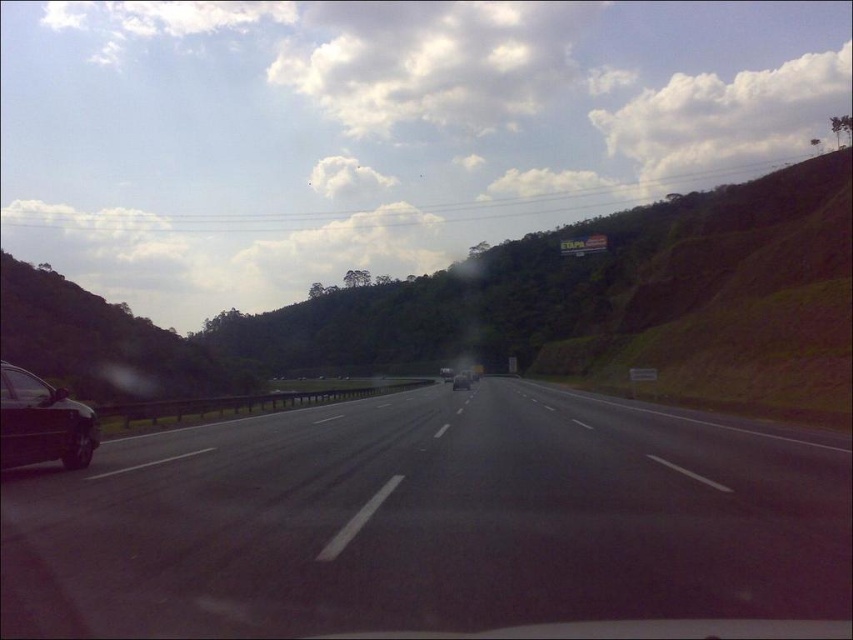
Can you confirm if black asphalt highway at center is shorter than shiny black sedan at left?

Correct, black asphalt highway at center is not as tall as shiny black sedan at left.

This screenshot has width=853, height=640. Find the location of `black asphalt highway at center`. black asphalt highway at center is located at coordinates (432, 520).

Which of these two, shiny black sedan at left or metallic silver sedan at center, stands shorter?

shiny black sedan at left

Between shiny black sedan at left and metallic silver sedan at center, which one is positioned lower?

Positioned lower is metallic silver sedan at center.

The height and width of the screenshot is (640, 853). Describe the element at coordinates (42, 422) in the screenshot. I see `shiny black sedan at left` at that location.

Locate an element on the screen. This screenshot has height=640, width=853. shiny black sedan at left is located at coordinates click(x=42, y=422).

Between metallic silver car at center and metallic silver sedan at center, which one has more height?

metallic silver car at center is taller.

Is metallic silver car at center below metallic silver sedan at center?

No.

The height and width of the screenshot is (640, 853). Identify the location of metallic silver car at center. (461, 380).